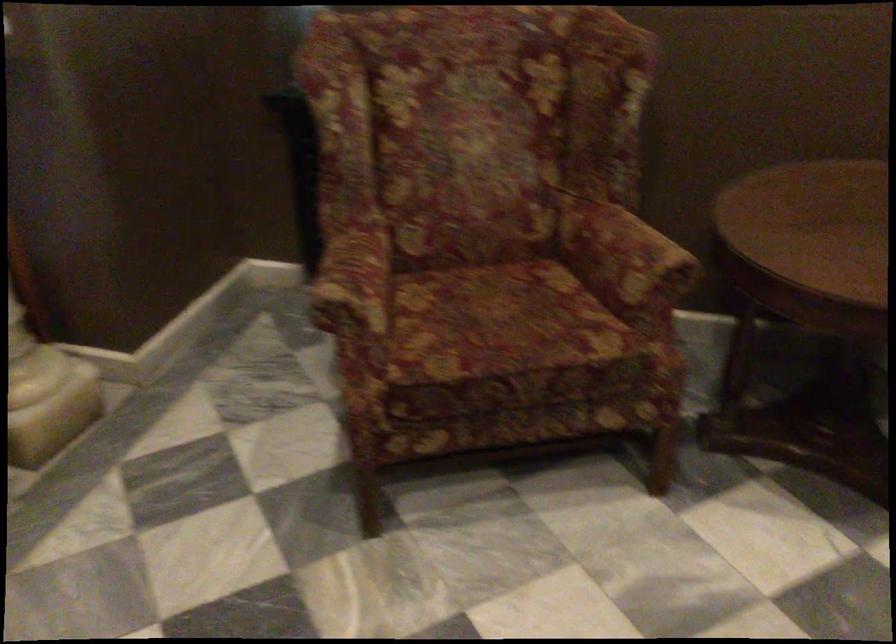
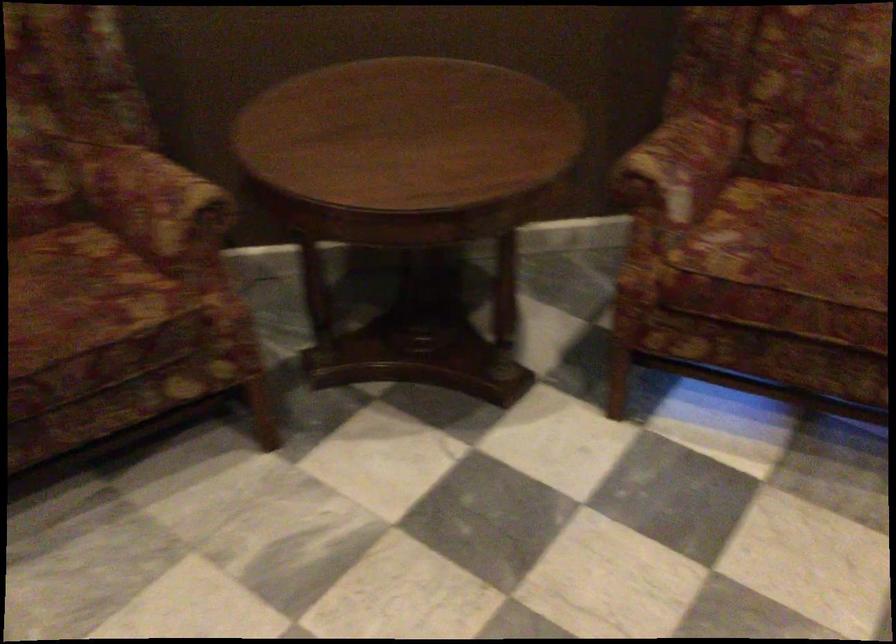
The images are taken continuously from a first-person perspective. In which direction are you moving?

The cameraman moved toward right, forward.